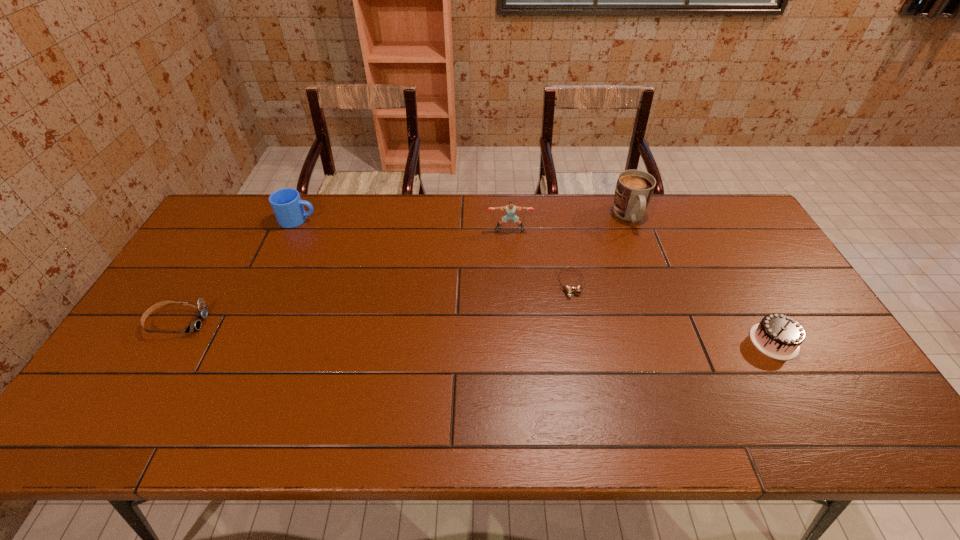
Locate an element on the screen. The height and width of the screenshot is (540, 960). the tallest object is located at coordinates click(x=634, y=188).

At what (x,y) coordinates should I click in order to perform the action: click on the second object from right to left. Please return your answer as a coordinate pair (x, y). This screenshot has height=540, width=960. Looking at the image, I should click on (634, 188).

Identify the location of puncher. The width and height of the screenshot is (960, 540). (510, 209).

The height and width of the screenshot is (540, 960). In order to click on the second object from left to right in this screenshot , I will do [x=286, y=203].

At what (x,y) coordinates should I click in order to perform the action: click on the left mug. Please return your answer as a coordinate pair (x, y). The image size is (960, 540). Looking at the image, I should click on (286, 203).

Where is `the rightmost object`? This screenshot has height=540, width=960. the rightmost object is located at coordinates (779, 336).

Find the location of a particular element. the nearer goggles is located at coordinates (202, 312).

I want to click on the leftmost object, so click(202, 312).

The height and width of the screenshot is (540, 960). Find the location of `the right goggles`. the right goggles is located at coordinates (568, 289).

Where is `the farther goggles`? the farther goggles is located at coordinates (568, 289).